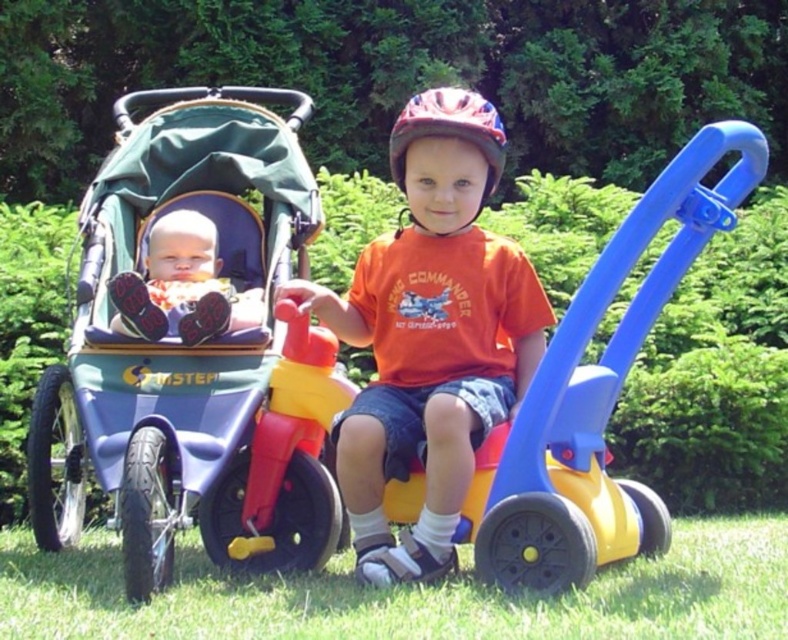
Is matte black shoes at center smaller than matte red bicycle helmet at center?

No.

Between point (197, 289) and point (485, 180), which one is positioned in front?

Positioned in front is point (485, 180).

This screenshot has width=788, height=640. Find the location of `matte black shoes at center`. matte black shoes at center is located at coordinates (180, 284).

Is the position of green grass at lower center less distant than that of matte black shoes at center?

Yes, green grass at lower center is in front of matte black shoes at center.

Who is positioned more to the left, green grass at lower center or matte black shoes at center?

Positioned to the left is matte black shoes at center.

Which is behind, point (742, 540) or point (188, 280)?

The point (742, 540) is more distant.

This screenshot has width=788, height=640. In order to click on green grass at lower center in this screenshot , I will do `click(407, 595)`.

Is orange matte shirt at center shorter than matte red bicycle helmet at center?

In fact, orange matte shirt at center may be taller than matte red bicycle helmet at center.

Is point (440, 125) farther from viewer compared to point (400, 136)?

No, it is not.

The width and height of the screenshot is (788, 640). What are the coordinates of `orange matte shirt at center` in the screenshot? It's located at (430, 333).

You are a GUI agent. You are given a task and a screenshot of the screen. Output one action in this format:
    pyautogui.click(x=<x>, y=<y>)
    Task: Click on the orange matte shirt at center
    The height and width of the screenshot is (640, 788).
    Given the screenshot: What is the action you would take?
    pyautogui.click(x=430, y=333)